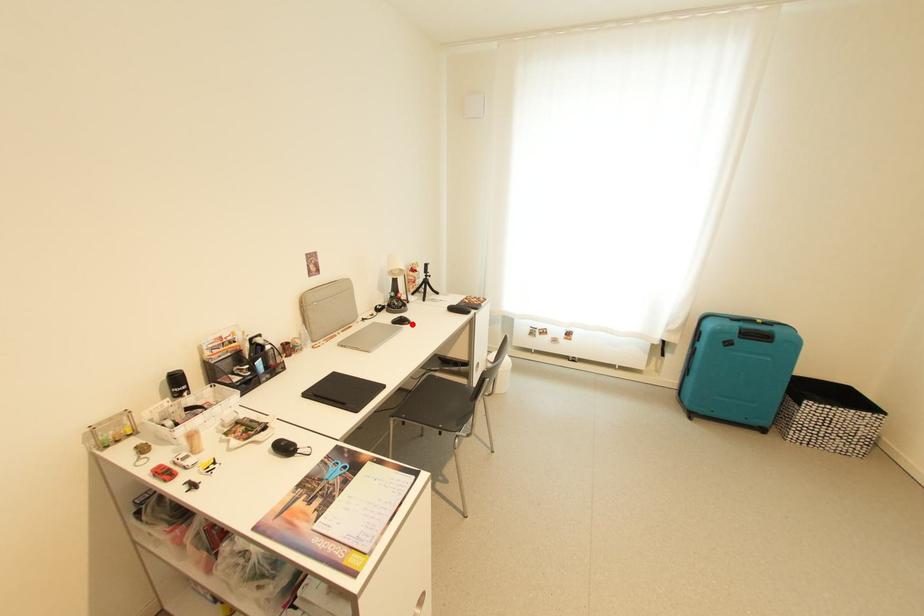
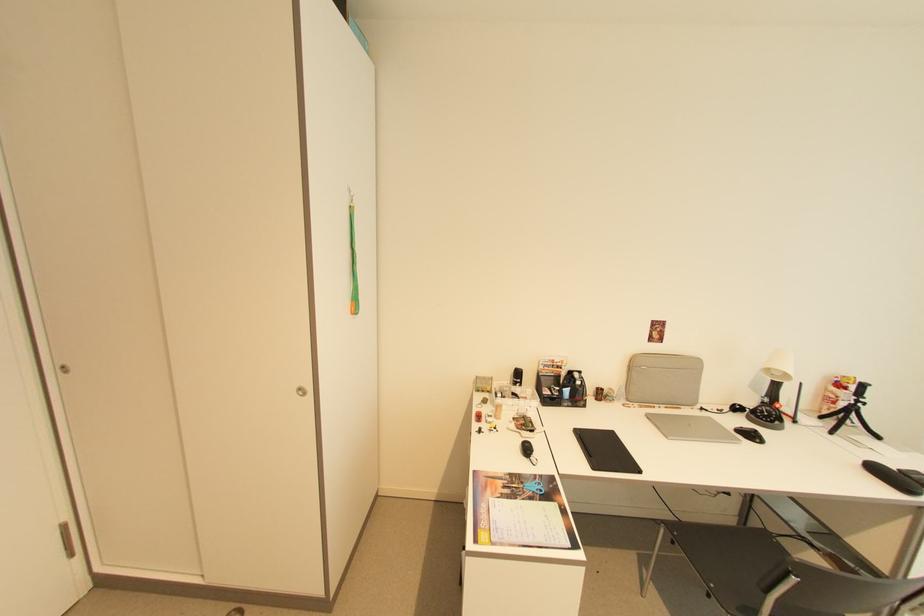
In the second image, find the point that corresponds to the highlighted location in the first image.

(762, 442)